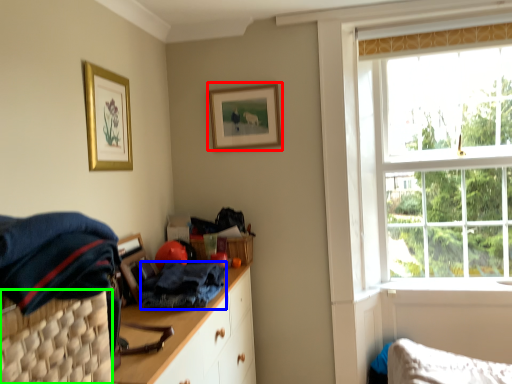
Question: Which object is the farthest from picture frame (highlighted by a red box)? Choose among these: clothing (highlighted by a blue box) or basket (highlighted by a green box).

Choices:
 (A) clothing
 (B) basket

Answer: (B)